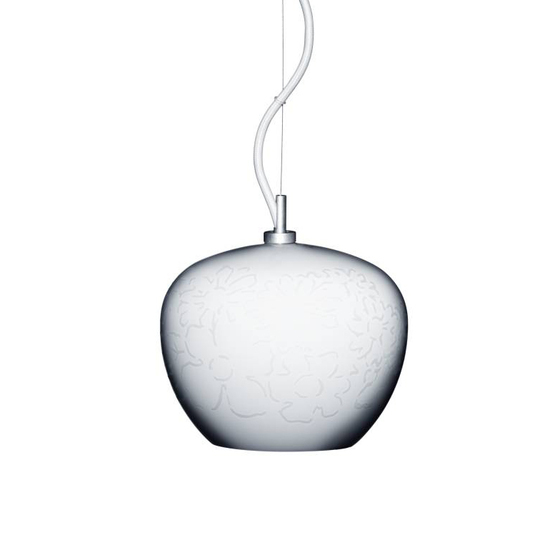
The image size is (560, 560). I want to click on power cord, so click(269, 116).